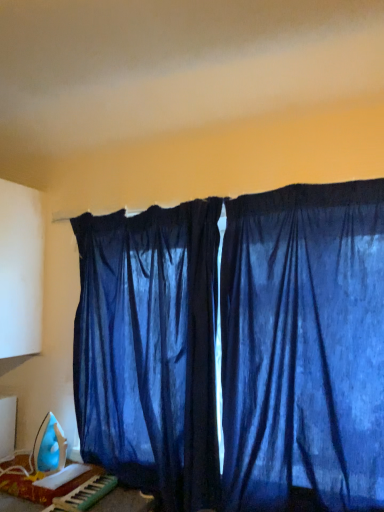
Question: From a real-world perspective, is blue plastic iron at lower left positioned above or below plastic green and white musical keyboard at lower left?

Choices:
 (A) below
 (B) above

Answer: (A)

Question: Considering the positions of blue plastic iron at lower left and plastic green and white musical keyboard at lower left in the image, is blue plastic iron at lower left taller or shorter than plastic green and white musical keyboard at lower left?

Choices:
 (A) tall
 (B) short

Answer: (B)

Question: Which is farther from the satin blue curtain at center, the second curtain when ordered from right to left?

Choices:
 (A) blue plastic iron at lower left
 (B) blue sheer curtains at center, the second curtain viewed from the left
 (C) plastic green and white musical keyboard at lower left

Answer: (C)

Question: Estimate the real-world distances between objects in this image. Which object is closer to the satin blue curtain at center, which is counted as the 1th curtain, starting from the left?

Choices:
 (A) blue plastic iron at lower left
 (B) blue sheer curtains at center, which is the 1th curtain in right-to-left order
 (C) plastic green and white musical keyboard at lower left

Answer: (B)